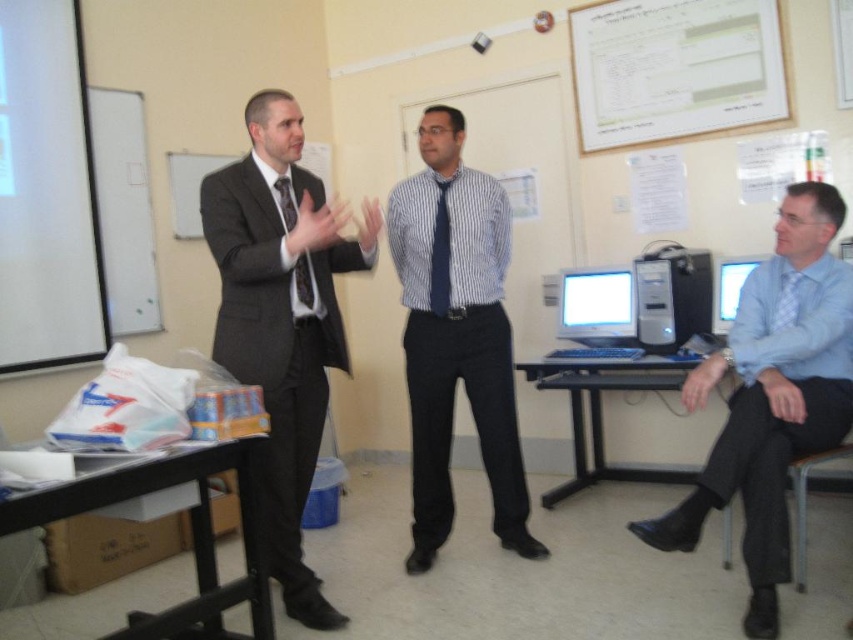
Question: Among these points, which one is nearest to the camera?

Choices:
 (A) (126, 312)
 (B) (585, 326)
 (C) (209, 616)

Answer: (C)

Question: Can you confirm if matte black suit at center is wider than light blue shirt at right?

Choices:
 (A) yes
 (B) no

Answer: (B)

Question: Is light blue shirt at right above black plastic table at lower right?

Choices:
 (A) no
 (B) yes

Answer: (B)

Question: Which object is farther from the camera taking this photo?

Choices:
 (A) whiteboard at left
 (B) light blue shirt at right
 (C) black plastic table at lower left
 (D) matte black monitor at center

Answer: (A)

Question: Which point appears farthest from the camera in this image?

Choices:
 (A) (843, 272)
 (B) (144, 468)
 (C) (436, 320)

Answer: (C)

Question: Can you confirm if light blue shirt at right is smaller than blue striped shirt at center?

Choices:
 (A) no
 (B) yes

Answer: (A)